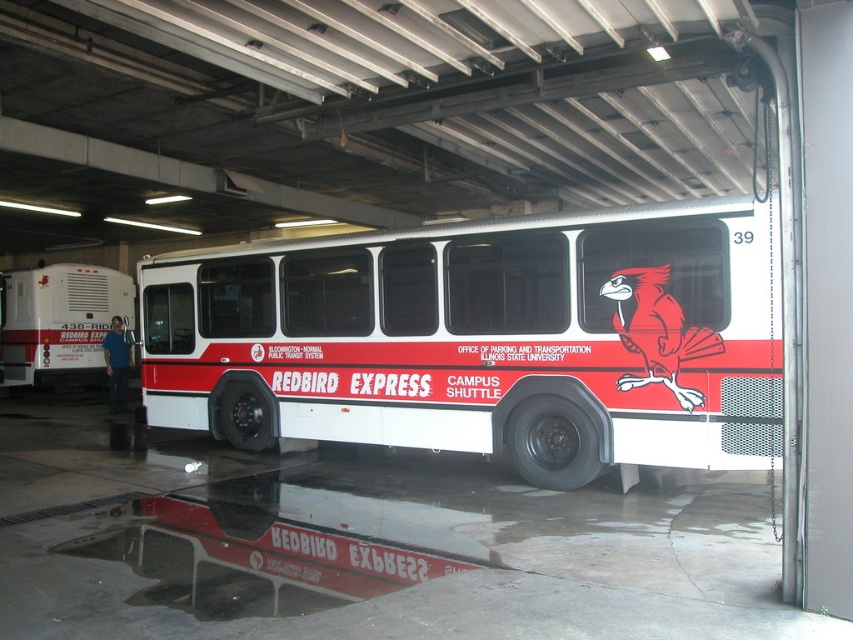
Which of these two, white matte bus at center or white matte trailer at left, stands taller?

white matte trailer at left

Measure the distance from white matte bus at center to white matte trailer at left.

A distance of 49.06 feet exists between white matte bus at center and white matte trailer at left.

From the picture: Who is more distant from viewer, (354, 275) or (38, 378)?

The point (38, 378) is behind.

You are a GUI agent. You are given a task and a screenshot of the screen. Output one action in this format:
    pyautogui.click(x=<x>, y=<y>)
    Task: Click on the white matte bus at center
    
    Given the screenshot: What is the action you would take?
    pyautogui.click(x=485, y=339)